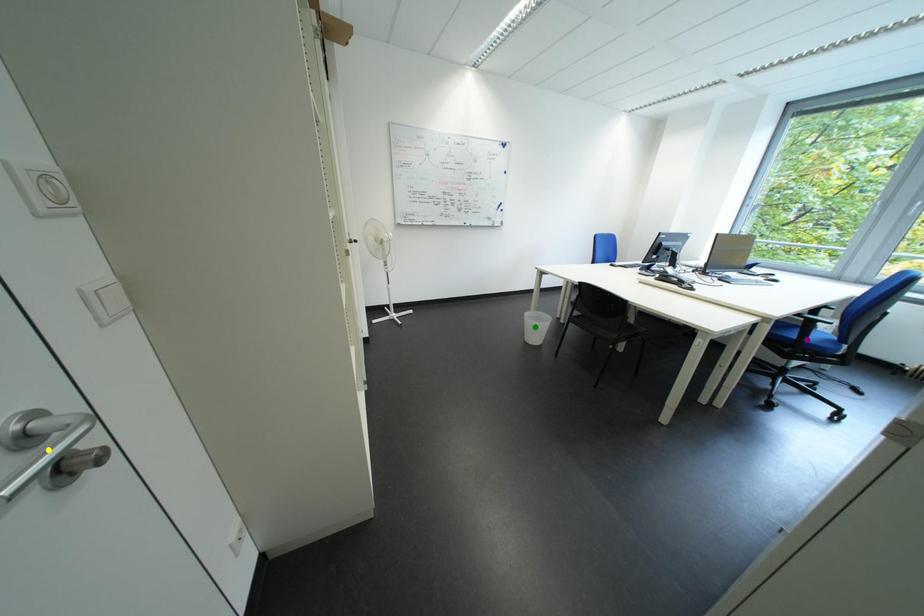
Order these from farthest to nearest:
1. purple point
2. green point
3. yellow point

1. green point
2. purple point
3. yellow point